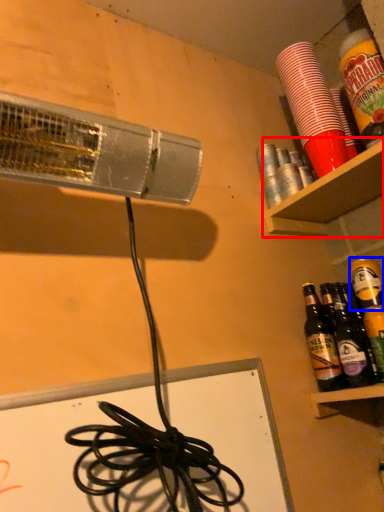
Question: Which object is further to the camera taking this photo, shelf (highlighted by a red box) or beer (highlighted by a blue box)?

Choices:
 (A) shelf
 (B) beer

Answer: (B)